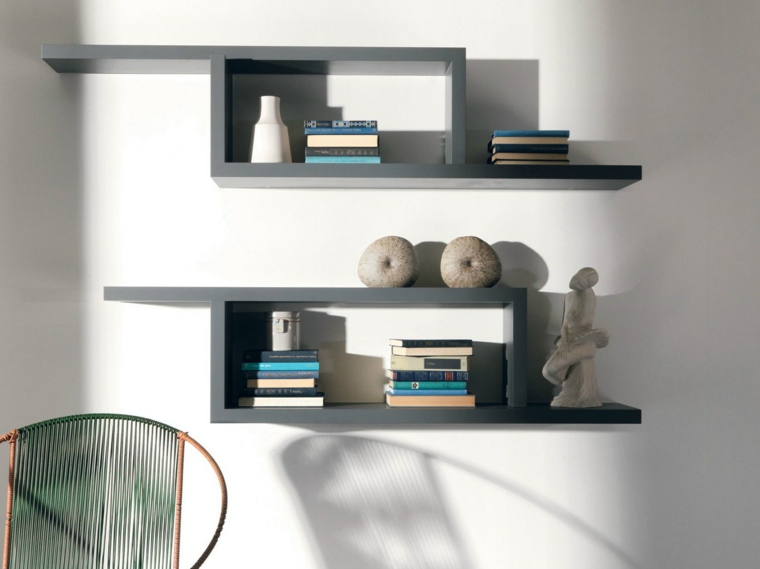
Identify the location of books on the inside of top shelf. This screenshot has width=760, height=569. (327, 162), (321, 150), (318, 137), (318, 127), (350, 123).